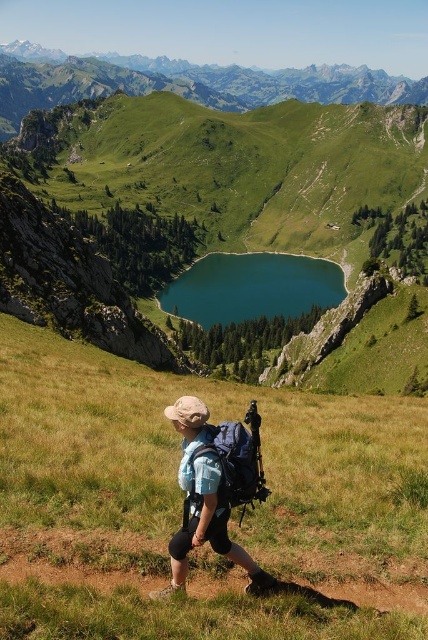
Question: Can you confirm if blue fabric backpack at center is bigger than matte blue backpack at center?

Choices:
 (A) no
 (B) yes

Answer: (B)

Question: Which object is farther from the camera taking this photo?

Choices:
 (A) teal glossy water at center
 (B) blue fabric backpack at center

Answer: (A)

Question: In this image, where is blue fabric backpack at center located relative to teal glossy water at center?

Choices:
 (A) above
 (B) below

Answer: (B)

Question: Which of these objects is positioned farthest from the matte blue backpack at center?

Choices:
 (A) green grassy mountain at upper center
 (B) green grassy at center
 (C) teal glossy water at center

Answer: (A)

Question: Is green grassy at center to the left of teal glossy water at center from the viewer's perspective?

Choices:
 (A) no
 (B) yes

Answer: (B)

Question: Estimate the real-world distances between objects in this image. Which object is farther from the blue fabric backpack at center?

Choices:
 (A) matte blue backpack at center
 (B) green grassy at center
 (C) teal glossy water at center

Answer: (C)